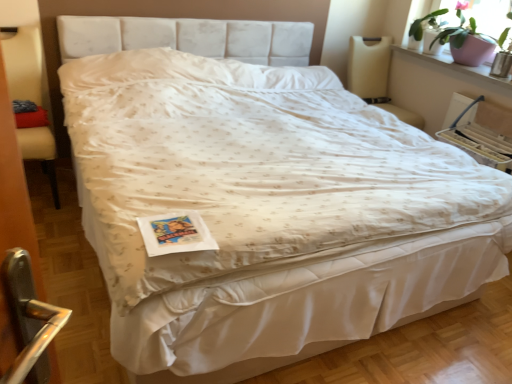
Question: Are green matte plant at upper right and pink ceramic pot at upper right beside each other?

Choices:
 (A) yes
 (B) no

Answer: (A)

Question: Does green matte plant at upper right contain pink ceramic pot at upper right?

Choices:
 (A) yes
 (B) no

Answer: (B)

Question: Is green matte plant at upper right oriented towards pink ceramic pot at upper right?

Choices:
 (A) yes
 (B) no

Answer: (B)

Question: Is green matte plant at upper right closer to camera compared to pink ceramic pot at upper right?

Choices:
 (A) no
 (B) yes

Answer: (A)

Question: Does green matte plant at upper right have a greater width compared to pink ceramic pot at upper right?

Choices:
 (A) no
 (B) yes

Answer: (A)

Question: Considering the relative positions of green matte plant at upper right and pink ceramic pot at upper right in the image provided, is green matte plant at upper right to the left of pink ceramic pot at upper right from the viewer's perspective?

Choices:
 (A) no
 (B) yes

Answer: (B)

Question: Does beige fabric armchair at left have a smaller size compared to pink ceramic pot at upper right?

Choices:
 (A) no
 (B) yes

Answer: (A)

Question: Can you confirm if beige fabric armchair at left is thinner than pink ceramic pot at upper right?

Choices:
 (A) yes
 (B) no

Answer: (B)

Question: Is pink ceramic pot at upper right at the back of beige fabric armchair at left?

Choices:
 (A) no
 (B) yes

Answer: (A)

Question: Would you consider beige fabric armchair at left to be distant from pink ceramic pot at upper right?

Choices:
 (A) no
 (B) yes

Answer: (B)

Question: Is beige fabric armchair at left shorter than pink ceramic pot at upper right?

Choices:
 (A) yes
 (B) no

Answer: (B)

Question: Considering the relative positions of beige fabric armchair at left and pink ceramic pot at upper right in the image provided, is beige fabric armchair at left to the right of pink ceramic pot at upper right from the viewer's perspective?

Choices:
 (A) no
 (B) yes

Answer: (A)

Question: Is green matte plant at upper right smaller than beige fabric armchair at left?

Choices:
 (A) yes
 (B) no

Answer: (A)